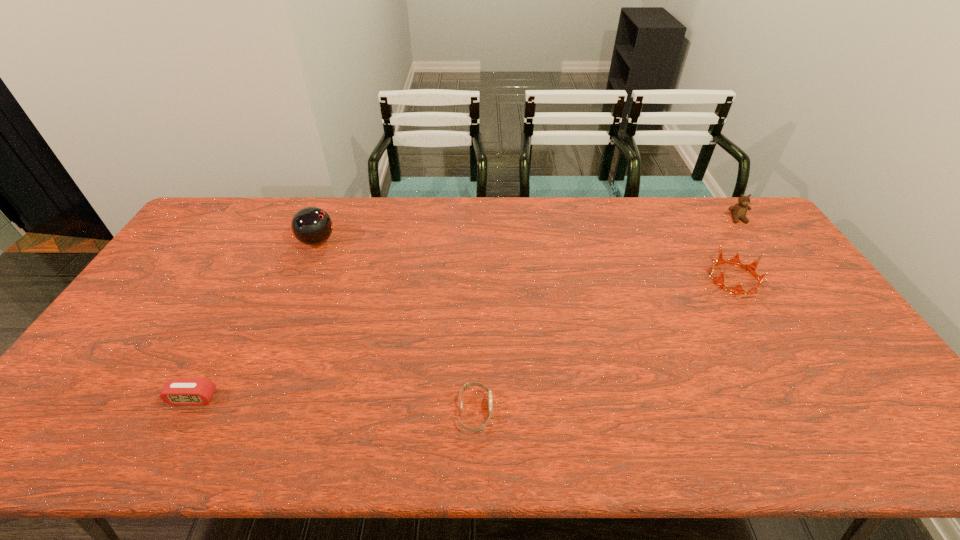
Where is `vacant area that lies between the third object from left to right and the crown`? This screenshot has height=540, width=960. vacant area that lies between the third object from left to right and the crown is located at coordinates (605, 345).

This screenshot has height=540, width=960. Identify the location of free area in between the rightmost object and the alarm clock. (466, 308).

Where is `empty space between the leftmost object and the watch`? The image size is (960, 540). empty space between the leftmost object and the watch is located at coordinates (334, 404).

What are the coordinates of `object that is the second closest to the crown` in the screenshot? It's located at (467, 385).

The width and height of the screenshot is (960, 540). In order to click on the closest object to the alarm clock in this screenshot , I will do `click(312, 226)`.

Find the location of `free space that satisfies the following two spatial constraints: 1. on the surface of the tallest object near the finger holes; 2. on the right side of the third tallest object`. free space that satisfies the following two spatial constraints: 1. on the surface of the tallest object near the finger holes; 2. on the right side of the third tallest object is located at coordinates (301, 279).

This screenshot has width=960, height=540. Find the location of `blank space that satisfies the following two spatial constraints: 1. on the surface of the tallest object near the finger holes; 2. on the front-facing side of the alarm clock`. blank space that satisfies the following two spatial constraints: 1. on the surface of the tallest object near the finger holes; 2. on the front-facing side of the alarm clock is located at coordinates (252, 398).

Find the location of a particular element. This screenshot has height=540, width=960. free location that satisfies the following two spatial constraints: 1. at the face of the farthest object; 2. on the surface of the second farthest object near the finger holes is located at coordinates (754, 241).

Where is `vacant space that satisfies the following two spatial constraints: 1. at the face of the farthest object; 2. on the face of the third object from right to left`? vacant space that satisfies the following two spatial constraints: 1. at the face of the farthest object; 2. on the face of the third object from right to left is located at coordinates (872, 411).

The height and width of the screenshot is (540, 960). I want to click on blank space that satisfies the following two spatial constraints: 1. at the face of the teddy bear; 2. on the face of the watch, so click(x=872, y=411).